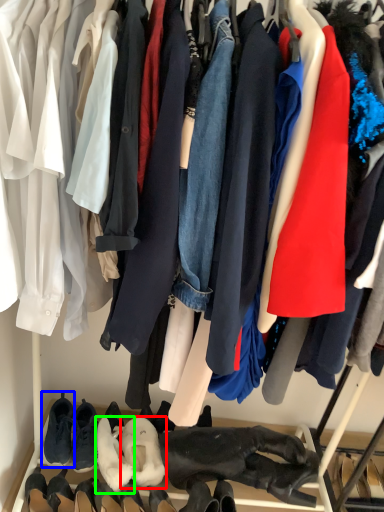
Question: Which is nearer to the footwear (highlighted by a red box)? footwear (highlighted by a blue box) or footwear (highlighted by a green box).

Choices:
 (A) footwear
 (B) footwear

Answer: (B)